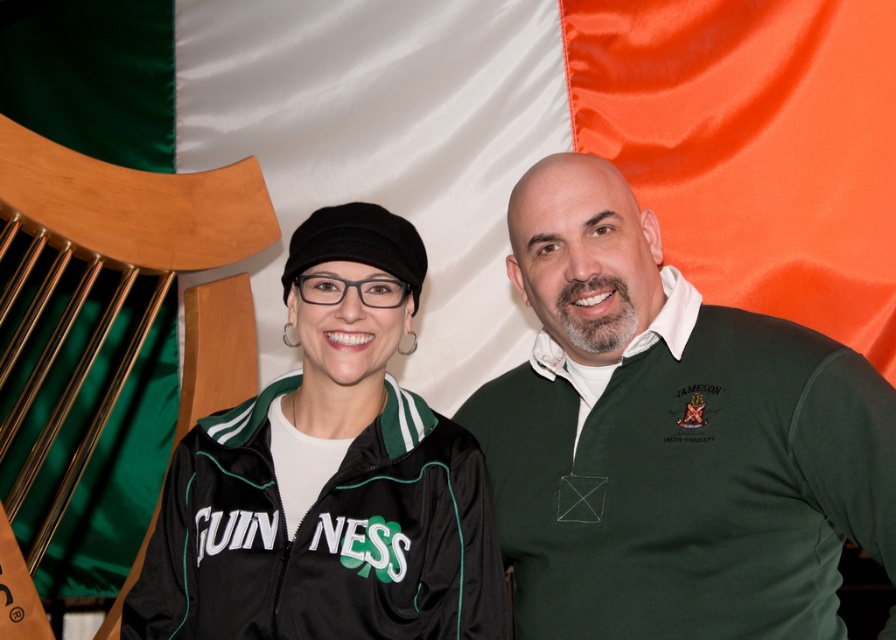
Question: Which point is closer to the camera taking this photo?

Choices:
 (A) (800, 348)
 (B) (177, 465)

Answer: (A)

Question: Which point is closer to the camera?

Choices:
 (A) green jersey at center
 (B) black fabric jacket at center

Answer: (A)

Question: In this image, where is green jersey at center located relative to black fabric jacket at center?

Choices:
 (A) below
 (B) above

Answer: (A)

Question: Which point appears closest to the camera in this image?

Choices:
 (A) (678, 440)
 (B) (291, 588)

Answer: (B)

Question: Is green jersey at center to the left of black fabric jacket at center from the viewer's perspective?

Choices:
 (A) no
 (B) yes

Answer: (A)

Question: Can you confirm if green jersey at center is positioned to the right of black fabric jacket at center?

Choices:
 (A) no
 (B) yes

Answer: (B)